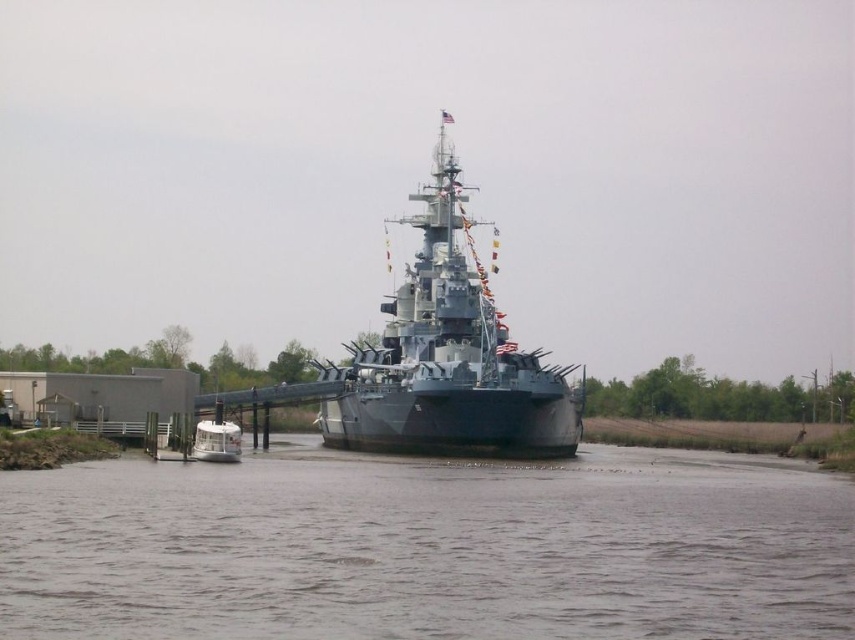
You are a tour boat captain navigating a narrow river. Your boat is 60 feet long. You see the gray water at center and the gray metallic battleship at center in the image. Can your boat safely pass between them without touching either?

The distance between the gray water at center and the gray metallic battleship at center is 63.62 feet. Since your boat is 60 feet long, it can safely pass through the space between them as there is enough clearance.